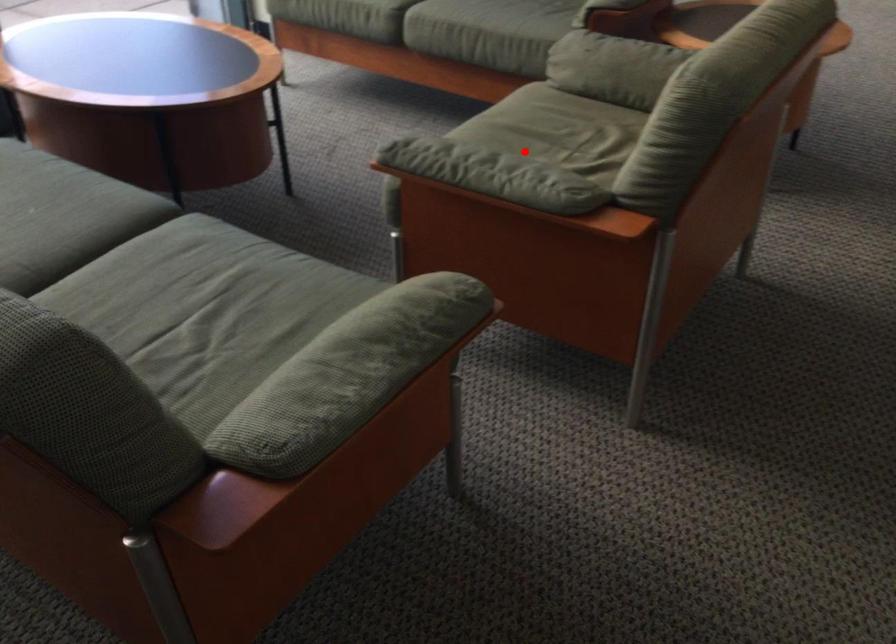
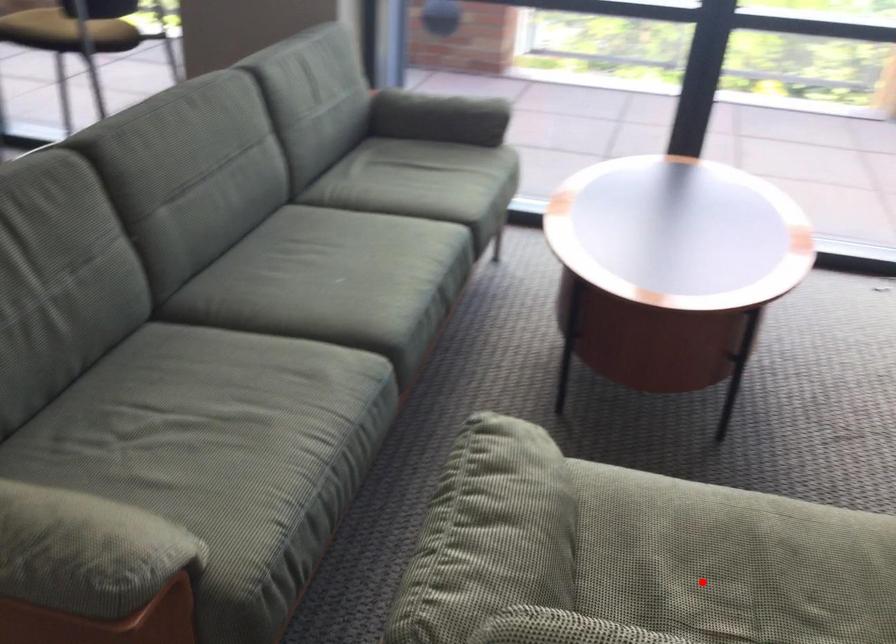
I am providing you with two images of the same scene from different viewpoints. A red point is marked on the first image and another point is marked on the second image. Do the highlighted points in image1 and image2 indicate the same real-world spot?

Yes